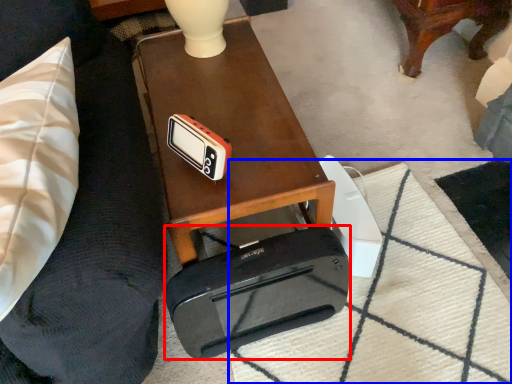
Question: Which object is closer to the camera taking this photo, cassette (highlighted by a red box) or mat (highlighted by a blue box)?

Choices:
 (A) cassette
 (B) mat

Answer: (A)